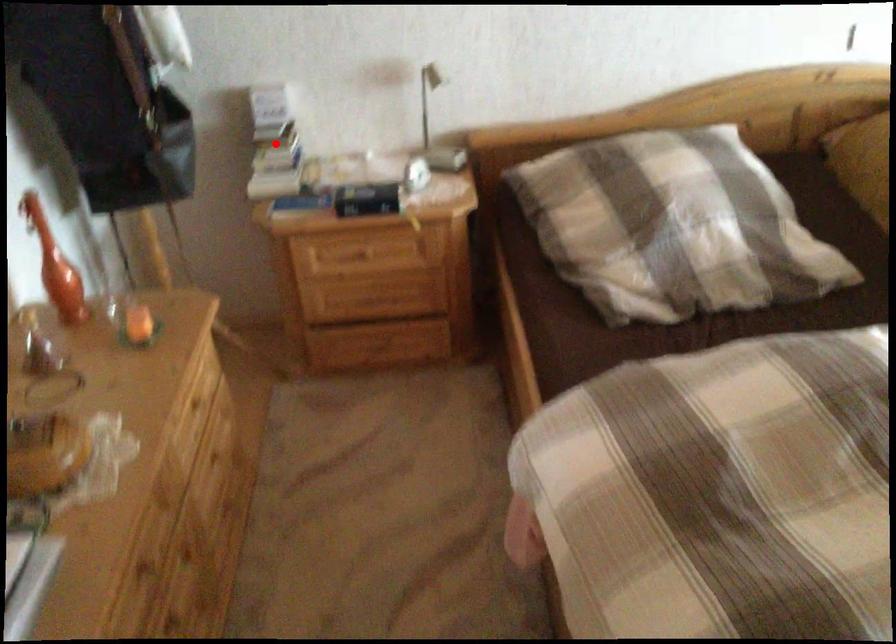
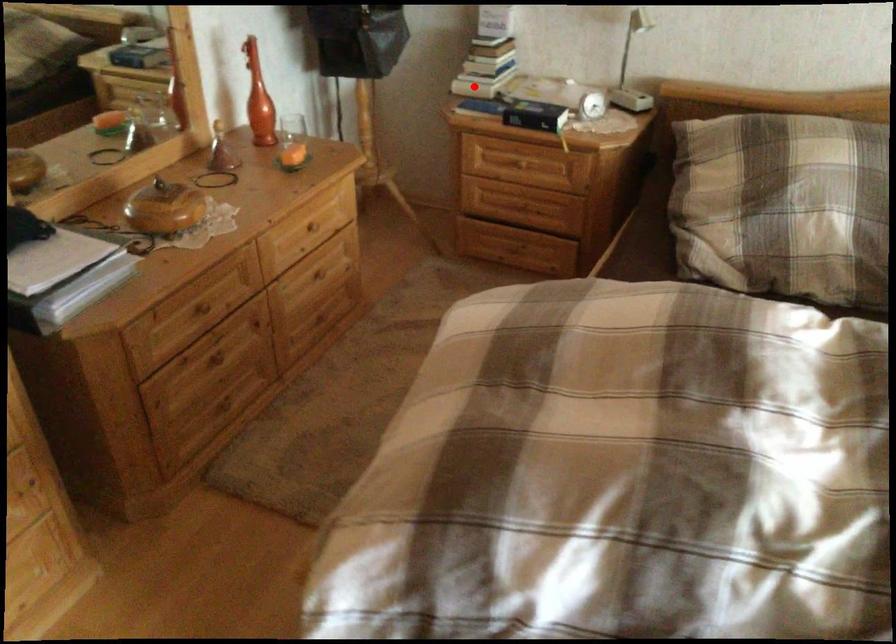
I am providing you with two images of the same scene from different viewpoints. A red point is marked on the first image and another point is marked on the second image. Are the points marked in image1 and image2 representing the same 3D position?

No